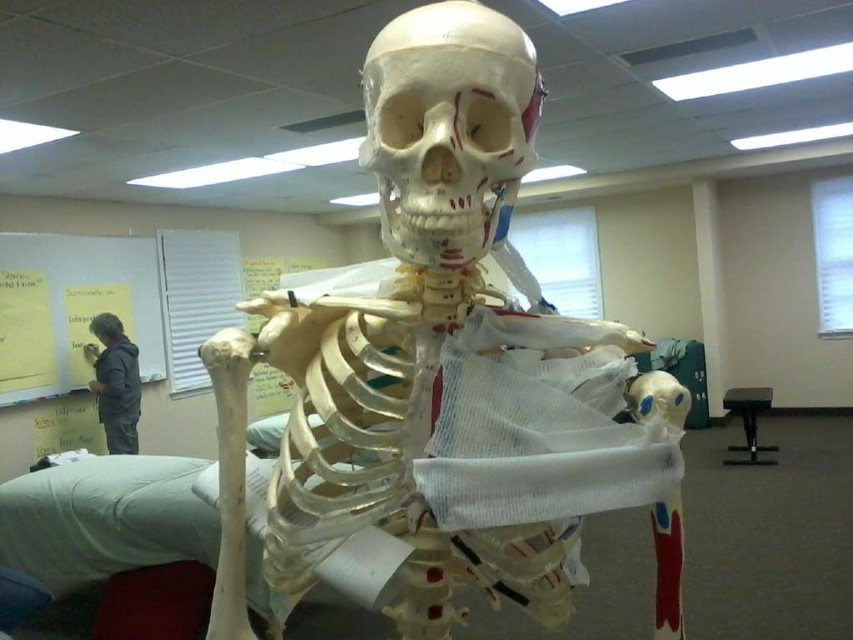
You are a student in the classroom and want to compare the height of the white matte skull at center and the white paperboard at upper left. Which one is taller?

The white paperboard at upper left is taller than the white matte skull at center.

You are a student in the classroom looking at the white matte skull at center and the dark gray jacket at upper left. Which object is nearer to you?

The white matte skull at center is closer to you than the dark gray jacket at upper left.